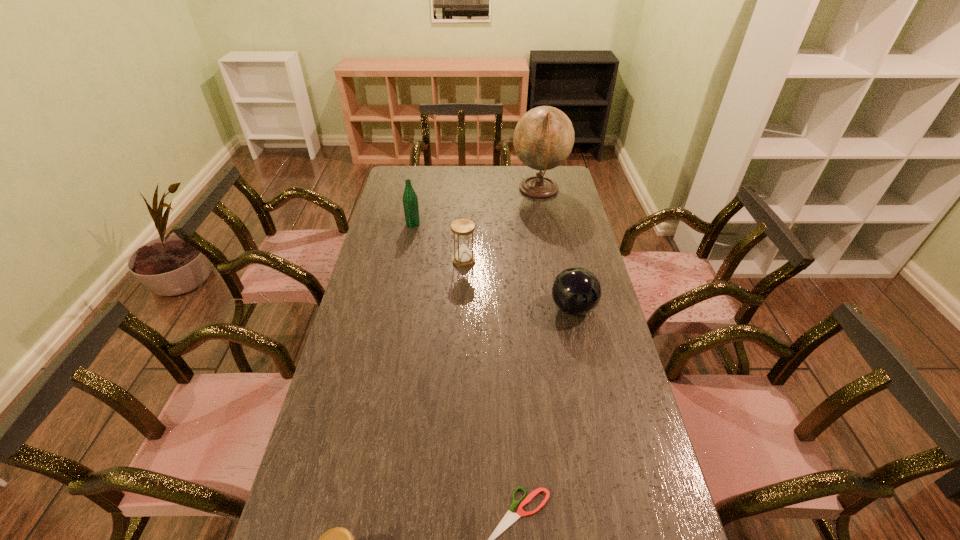
Locate an element on the screen. The width and height of the screenshot is (960, 540). free space located 0.400m on the front of the fifth shortest object is located at coordinates (400, 292).

At what (x,y) coordinates should I click in order to perform the action: click on vacant area situated on the left of the third object from left to right. Please return your answer as a coordinate pair (x, y). The image size is (960, 540). Looking at the image, I should click on (410, 260).

Identify the location of free region located 0.050m on the side of the bowling ball with the finger holes. (536, 308).

Image resolution: width=960 pixels, height=540 pixels. What are the coordinates of `vacant region located on the side of the bowling ball with the finger holes` in the screenshot? It's located at point(510,308).

At what (x,y) coordinates should I click in order to perform the action: click on vacant area situated 0.210m on the side of the bowling ball with the finger holes. Please return your answer as a coordinate pair (x, y). This screenshot has width=960, height=540. Looking at the image, I should click on (491, 308).

Identify the location of object at the far edge. (543, 138).

The width and height of the screenshot is (960, 540). I want to click on object located at the left edge, so click(x=410, y=199).

Identify the location of globe that is at the right edge. Image resolution: width=960 pixels, height=540 pixels. (543, 138).

Where is `bowling ball situated at the right edge`? bowling ball situated at the right edge is located at coordinates (576, 291).

This screenshot has width=960, height=540. I want to click on object present at the far right corner, so click(x=543, y=138).